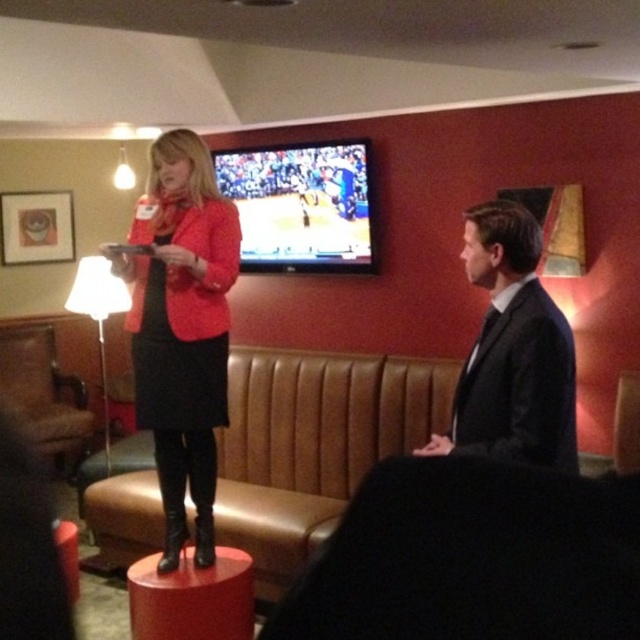
Question: Estimate the real-world distances between objects in this image. Which object is farther from the matte red blazer at center?

Choices:
 (A) brown leather armchair at left
 (B) black suit at center
 (C) matte red stool at center

Answer: (A)

Question: Which of the following is the closest to the observer?

Choices:
 (A) brown leather armchair at left
 (B) matte red blazer at center
 (C) matte red stool at center

Answer: (B)

Question: Is matte red blazer at center thinner than black suit at center?

Choices:
 (A) yes
 (B) no

Answer: (B)

Question: Is matte red blazer at center wider than black suit at center?

Choices:
 (A) no
 (B) yes

Answer: (B)

Question: Which point is closer to the camera?

Choices:
 (A) (248, 593)
 (B) (65, 436)

Answer: (A)

Question: Can you confirm if matte red blazer at center is bigger than brown leather armchair at left?

Choices:
 (A) yes
 (B) no

Answer: (B)